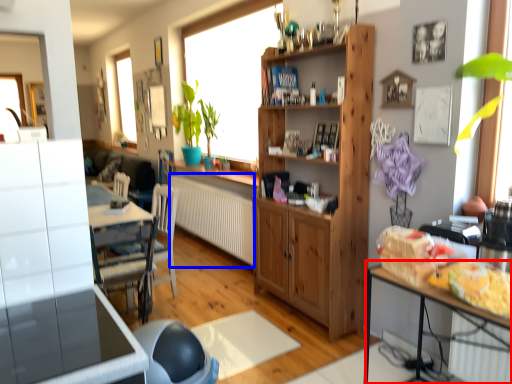
Question: Which point is closer to the camera, table (highlighted by a red box) or radiator (highlighted by a blue box)?

Choices:
 (A) table
 (B) radiator

Answer: (A)